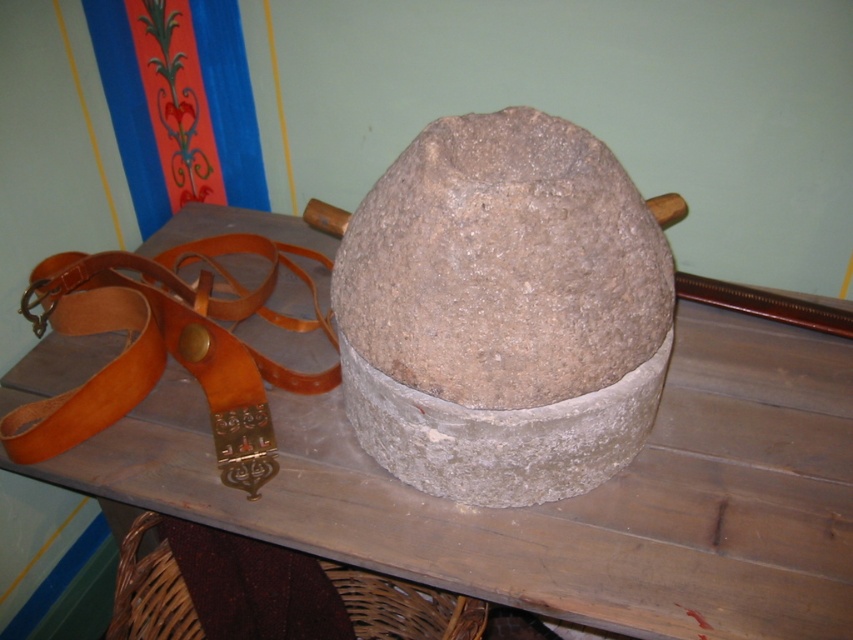
What do you see at coordinates (503, 264) in the screenshot? The height and width of the screenshot is (640, 853). I see `gray rough stone at center` at bounding box center [503, 264].

Which of these two, gray rough stone at center or brown leather belt at left, stands taller?

Standing taller between the two is brown leather belt at left.

Where is `gray rough stone at center`? gray rough stone at center is located at coordinates (503, 264).

Find the location of a particular element. The width and height of the screenshot is (853, 640). gray rough stone at center is located at coordinates (503, 264).

Is smooth wooden table at center further to the viewer compared to brown leather belt at left?

That is False.

Is point (764, 333) positioned after point (154, 291)?

Yes, it is behind point (154, 291).

Does point (141, 492) lie in front of point (216, 406)?

Yes, it is.

Where is `smooth wooden table at center`? smooth wooden table at center is located at coordinates (561, 500).

Can you confirm if smooth wooden table at center is taller than gray rough stone at center?

Correct, smooth wooden table at center is much taller as gray rough stone at center.

Can you confirm if smooth wooden table at center is shorter than gray rough stone at center?

No, smooth wooden table at center is not shorter than gray rough stone at center.

Locate an element on the screen. This screenshot has height=640, width=853. smooth wooden table at center is located at coordinates (561, 500).

This screenshot has height=640, width=853. Identify the location of smooth wooden table at center. (561, 500).